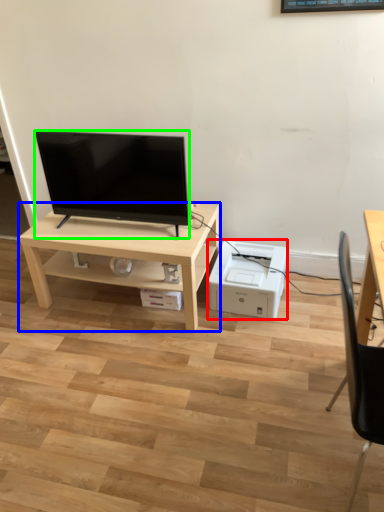
Question: Estimate the real-world distances between objects in this image. Which object is farther from printer (highlighted by a red box), table (highlighted by a blue box) or television (highlighted by a green box)?

Choices:
 (A) table
 (B) television

Answer: (B)